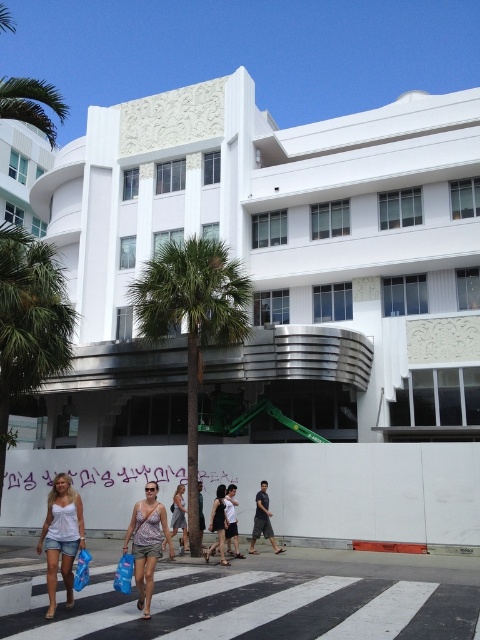
Does green leafy palm tree at center have a lesser height compared to green leafy palm tree at left?

Correct, green leafy palm tree at center is not as tall as green leafy palm tree at left.

Which is more to the right, green leafy palm tree at center or green leafy palm tree at left?

Positioned to the right is green leafy palm tree at center.

Image resolution: width=480 pixels, height=640 pixels. What are the coordinates of `green leafy palm tree at center` in the screenshot? It's located at (192, 321).

Where is `green leafy palm tree at center`? green leafy palm tree at center is located at coordinates (192, 321).

Between point (68, 536) and point (260, 506), which one is positioned behind?

Point (260, 506)

The image size is (480, 640). What do you see at coordinates (61, 536) in the screenshot?
I see `white cotton tank top at lower left` at bounding box center [61, 536].

You are a GUI agent. You are given a task and a screenshot of the screen. Output one action in this format:
    pyautogui.click(x=<x>, y=<y>)
    Task: Click on the white cotton tank top at lower left
    
    Given the screenshot: What is the action you would take?
    pyautogui.click(x=61, y=536)

Who is shorter, white cotton shirt at center or blue fabric bag at lower center?

With less height is blue fabric bag at lower center.

Based on the photo, is white cotton shirt at center smaller than blue fabric bag at lower center?

Actually, white cotton shirt at center might be larger than blue fabric bag at lower center.

At what (x,y) coordinates should I click in order to perform the action: click on white cotton shirt at center. Please return your answer as a coordinate pair (x, y). This screenshot has width=480, height=640. Looking at the image, I should click on (231, 520).